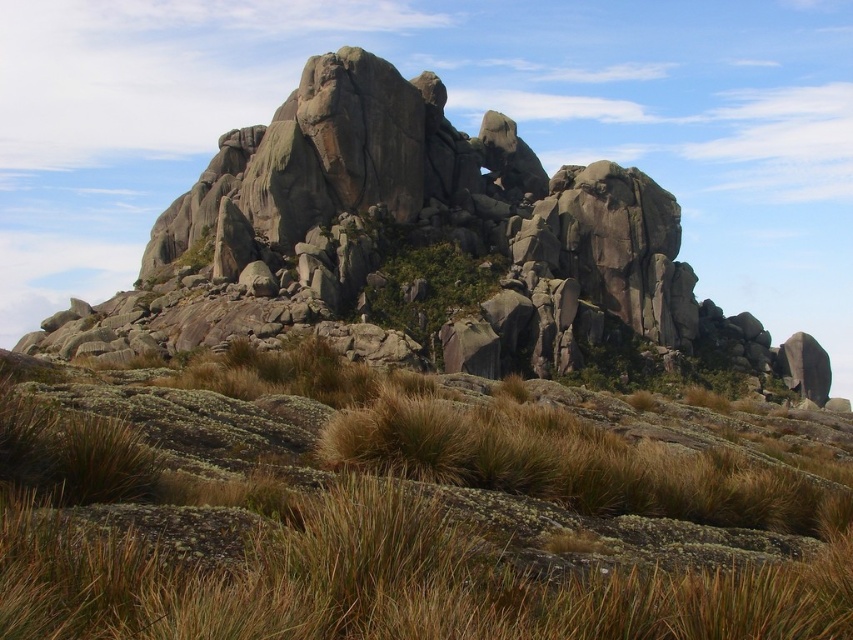
Consider the image. Which is below, brown grassy at center or green leafy shrub at center?

Positioned lower is brown grassy at center.

Is brown grassy at center further to the viewer compared to green leafy shrub at center?

That is False.

Measure the distance between point (260,545) and camera.

Point (260,545) and camera are 30.43 meters apart from each other.

Where is `brown grassy at center`? The height and width of the screenshot is (640, 853). brown grassy at center is located at coordinates (416, 557).

Is gray rough rock formation at center to the left of green leafy shrub at center from the viewer's perspective?

In fact, gray rough rock formation at center is to the right of green leafy shrub at center.

Which is above, gray rough rock formation at center or green leafy shrub at center?

gray rough rock formation at center

Locate an element on the screen. gray rough rock formation at center is located at coordinates (402, 220).

Locate an element on the screen. The image size is (853, 640). gray rough rock formation at center is located at coordinates (402, 220).

From the picture: Is brown grassy at center below gray rough rock formation at center?

Yes, brown grassy at center is below gray rough rock formation at center.

Can you confirm if brown grassy at center is thinner than gray rough rock formation at center?

Correct, brown grassy at center's width is less than gray rough rock formation at center's.

Is point (436, 541) positioned after point (91, 321)?

No, (436, 541) is closer to viewer.

Where is `brown grassy at center`? brown grassy at center is located at coordinates (416, 557).